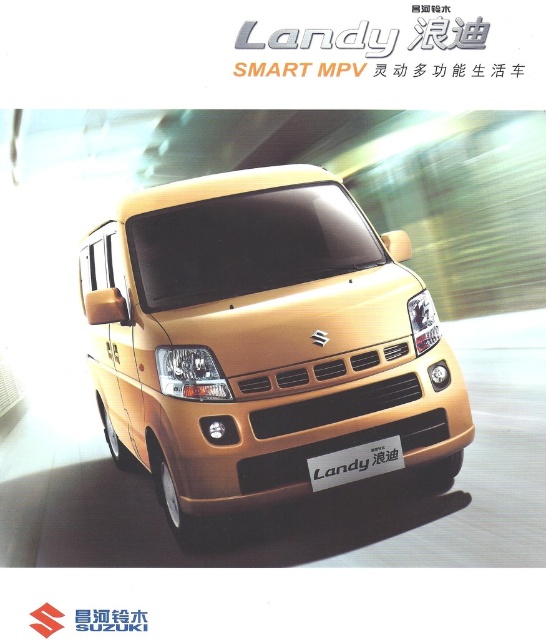
You are a photographer planning to take a picture of the gold metallic van at center and the silver metallic plate at center for an advertisement. Since you want to highlight the van, which object should be placed closer to the camera to make it appear bigger in the photo?

To highlight the gold metallic van at center, you should place it closer to the camera since it already has a larger size compared to the silver metallic plate at center, making it naturally appear bigger in the photo.

You are a photographer standing 10 feet away from a camera. You want to take a photo of the gold metallic van at center. Is the van within your camera range if the minimum focusing distance is 10 feet?

The gold metallic van at center is 9.99 feet away from the camera, which is just under the 10 feet minimum focusing distance. Therefore, the van is slightly too close to be in focus.